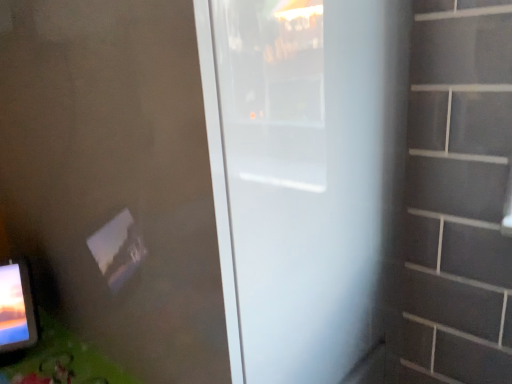
Question: From the image's perspective, is white matte door at center located above or below green matte table at lower left?

Choices:
 (A) above
 (B) below

Answer: (A)

Question: Is white matte door at center inside or outside of green matte table at lower left?

Choices:
 (A) inside
 (B) outside

Answer: (B)

Question: Does point (397, 225) appear closer or farther from the camera than point (66, 327)?

Choices:
 (A) closer
 (B) farther

Answer: (B)

Question: Would you say green matte table at lower left is inside or outside white matte door at center?

Choices:
 (A) outside
 (B) inside

Answer: (A)

Question: From the image's perspective, is green matte table at lower left located above or below white matte door at center?

Choices:
 (A) below
 (B) above

Answer: (A)

Question: Is point (69, 365) positioned closer to the camera than point (264, 175)?

Choices:
 (A) farther
 (B) closer

Answer: (A)

Question: Is green matte table at lower left bigger or smaller than white matte door at center?

Choices:
 (A) small
 (B) big

Answer: (A)